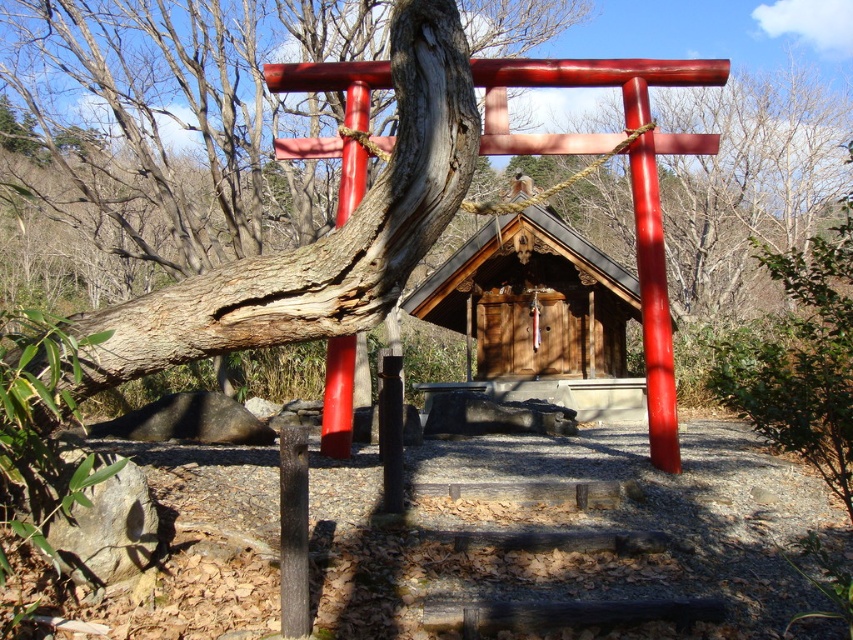
You are standing in front of the torii gate and want to enter the wooden door at center. Which direction should you look to see the wooden hut at center first?

The wooden hut at center is located below the wooden door at center, so you should look downward to see the wooden hut at center first before looking upward toward the wooden door at center.

You are standing at a distance and looking at the serene outdoor scene with the torii gate and shrine. There is a specific point marked at coordinates point (425, 278) in the image. Can you estimate how far this point is from your current position?

The point (425, 278) is 20.42 meters away from the viewer.